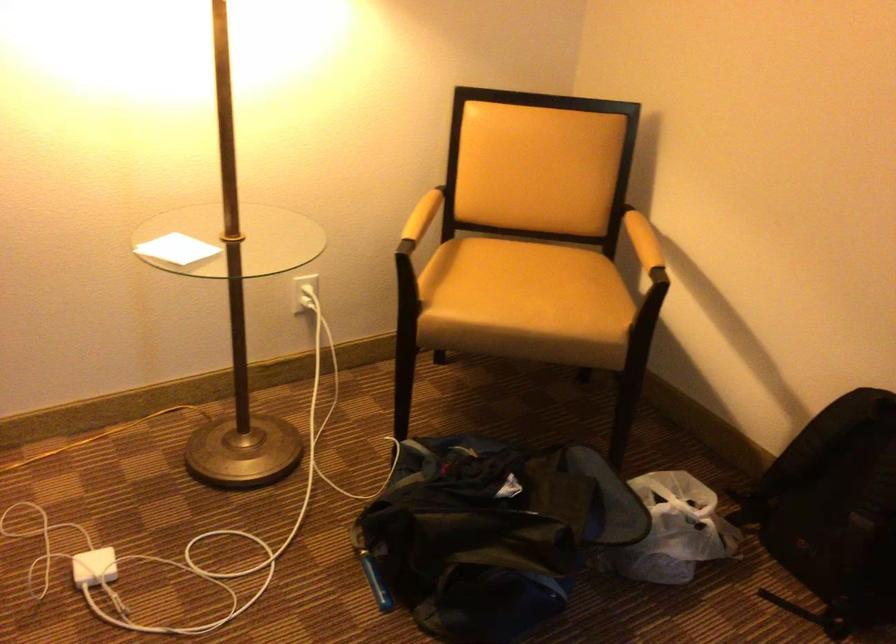
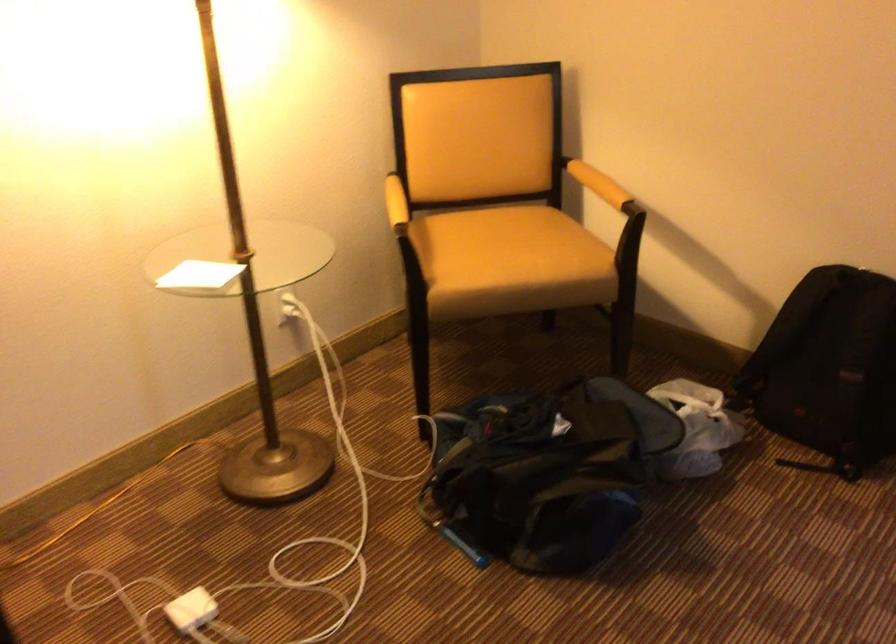
The point at (92, 569) is marked in the first image. Where is the corresponding point in the second image?

(192, 609)